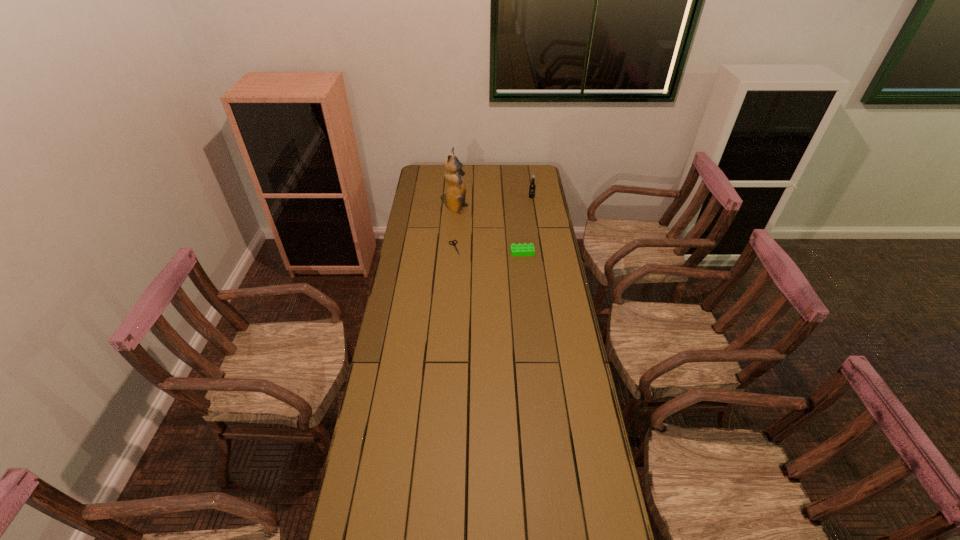
This screenshot has width=960, height=540. Find the location of `the tallest object`. the tallest object is located at coordinates (455, 187).

You are a GUI agent. You are given a task and a screenshot of the screen. Output one action in this format:
    pyautogui.click(x=<x>, y=<y>)
    Task: Click on the cat
    
    Given the screenshot: What is the action you would take?
    pyautogui.click(x=455, y=187)

I want to click on the rightmost object, so click(x=532, y=186).

Where is `the third shortest object`? The image size is (960, 540). the third shortest object is located at coordinates (532, 186).

This screenshot has height=540, width=960. I want to click on Lego, so click(519, 249).

Find the location of a particular element. This screenshot has height=540, width=960. the second object from right to left is located at coordinates (519, 249).

The width and height of the screenshot is (960, 540). In order to click on shears in this screenshot , I will do `click(454, 244)`.

In order to click on free region located on the face of the third nearest object in this screenshot , I will do `click(491, 210)`.

I want to click on free space located on the label of the rightmost object, so click(538, 237).

Locate an element on the screen. The width and height of the screenshot is (960, 540). free space located 0.310m on the front of the Lego is located at coordinates (528, 304).